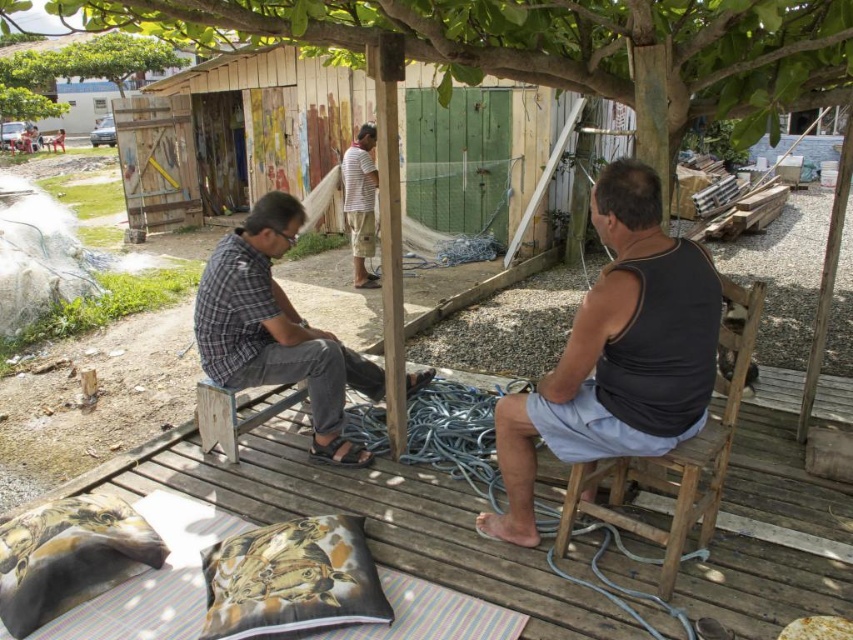
Question: Is wooden deck at center above striped cotton shirt at center?

Choices:
 (A) no
 (B) yes

Answer: (A)

Question: Among these objects, which one is nearest to the camera?

Choices:
 (A) wooden chair at right
 (B) plaid fabric shirt at left

Answer: (A)

Question: Is printed fabric pillow at lower center below striped cotton shirt at center?

Choices:
 (A) yes
 (B) no

Answer: (A)

Question: Can you confirm if wooden deck at center is thinner than striped cotton shirt at center?

Choices:
 (A) no
 (B) yes

Answer: (A)

Question: Which point appears farthest from the camera in this image?

Choices:
 (A) (13, 522)
 (B) (96, 77)
 (C) (318, 500)

Answer: (B)

Question: Which of the following is the farthest from the observer?

Choices:
 (A) green leafy tree at upper center
 (B) green leafy tree at upper left
 (C) black matte tank top at right
 (D) plaid fabric shirt at left

Answer: (B)